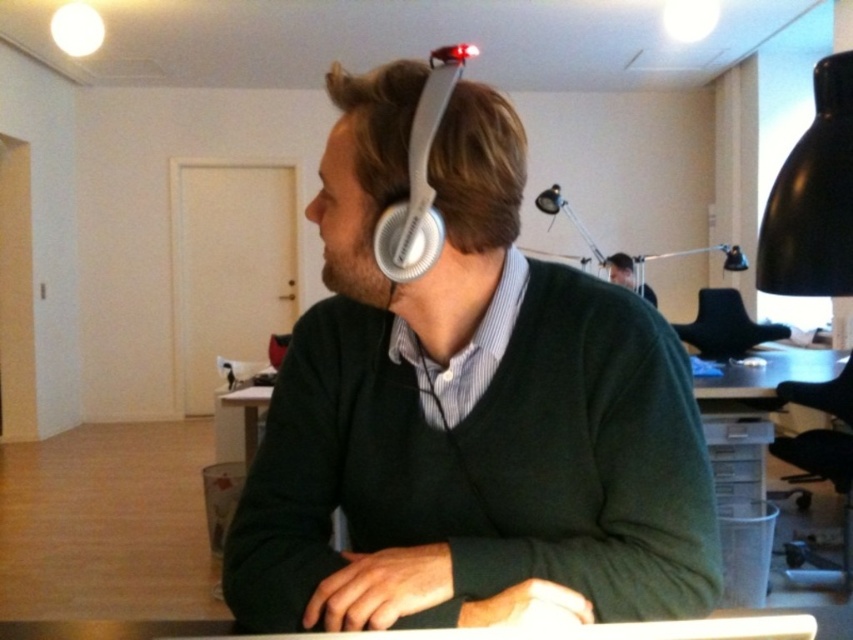
Question: Can you confirm if black leather chair at center is positioned to the right of matte green sweater at upper center?

Choices:
 (A) no
 (B) yes

Answer: (B)

Question: Does white matte earphone at upper center have a lesser width compared to black leather chair at center?

Choices:
 (A) no
 (B) yes

Answer: (B)

Question: Which of the following is the closest to the observer?

Choices:
 (A) (564, 339)
 (B) (412, 212)

Answer: (B)

Question: Based on their relative distances, which object is farther from the black leather chair at center?

Choices:
 (A) matte green sweater at upper center
 (B) white matte earphone at upper center
 (C) matte white headphones at center

Answer: (B)

Question: Can you confirm if matte white headphones at center is thinner than white matte earphone at upper center?

Choices:
 (A) no
 (B) yes

Answer: (A)

Question: Which point is farther to the camera?

Choices:
 (A) matte green sweater at upper center
 (B) white matte earphone at upper center
 (C) matte white headphones at center
 (D) black leather chair at center

Answer: (A)